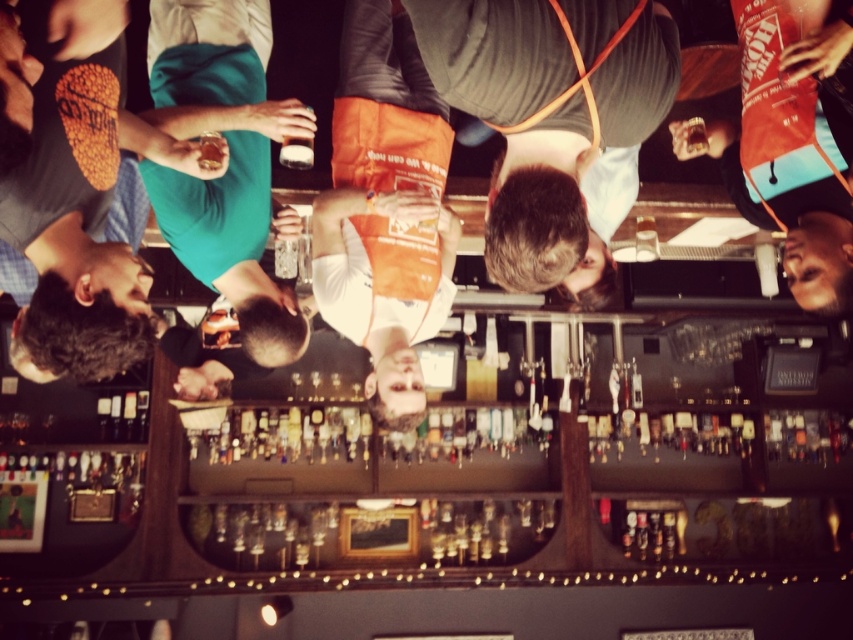
You are a bartender preparing drinks at the bar. You need to reach for an item located at the center of the bar counter. Which item will you have to reach over first, the dark gray fabric apron at center or the clear glass at center?

The dark gray fabric apron at center is much taller than the clear glass at center, so you will have to reach over the dark gray fabric apron at center first.